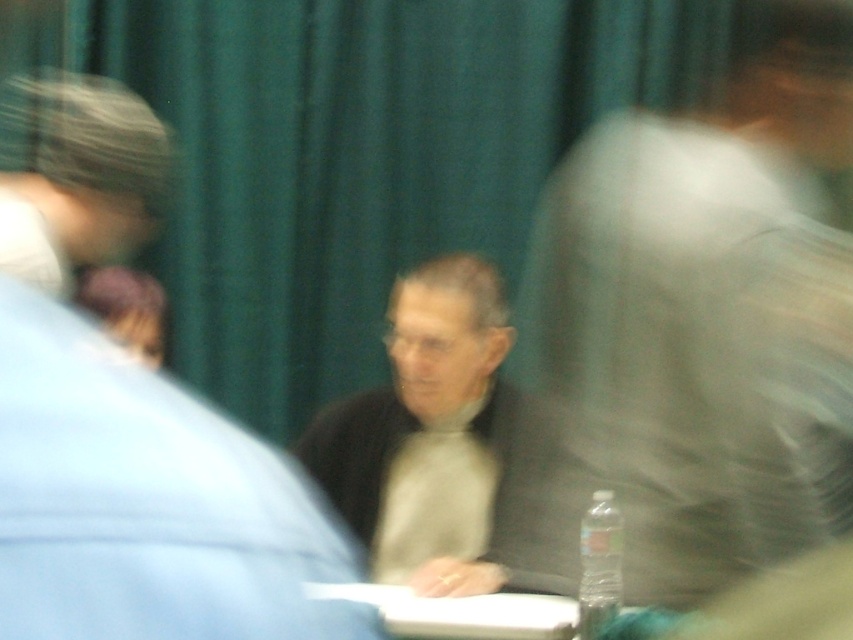
You are a photographer adjusting your camera settings to focus on the gray wool sweater at center and the white plastic table at center. Which object is closer to the camera lens?

The gray wool sweater at center is above the white plastic table at center, so it is closer to the camera lens.

You are organizing a conference and need to place a name tag on the table. The name tag is 10 cm tall. The light gray sweater at center and the clear plastic bottle at center are already on the table. Can you fit the name tag between them without overlapping either?

The light gray sweater at center is taller than the clear plastic bottle at center. Since the name tag is 10 cm tall, it can be placed between them as long as there is enough space between the two objects. However, the exact placement depends on their horizontal distance apart, which isn